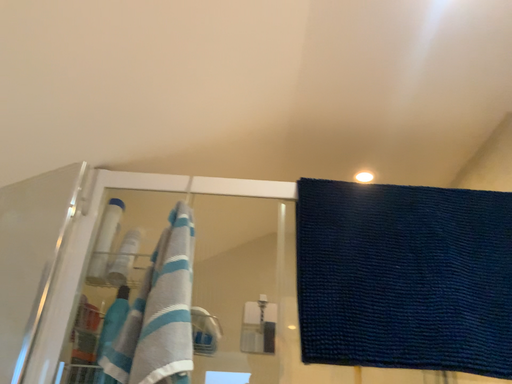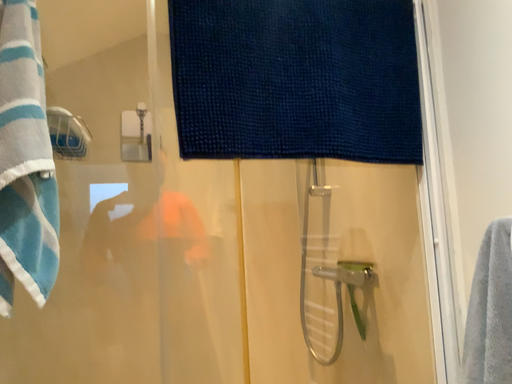
Question: Which way did the camera rotate in the video?

Choices:
 (A) rotated downward
 (B) rotated upward

Answer: (A)